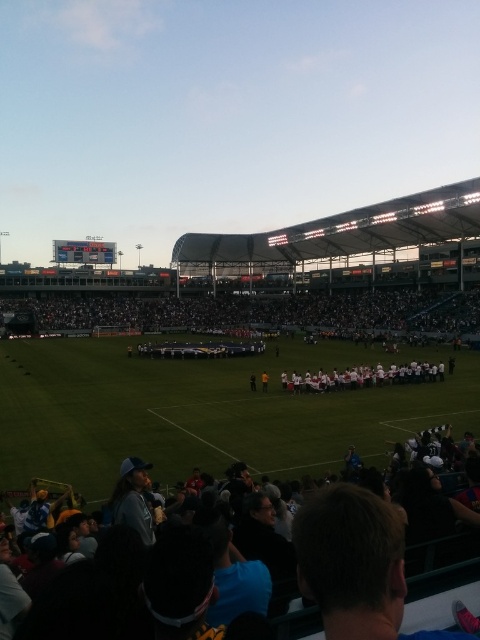
You are a photographer positioned at the edge of the field. You want to capture a photo that includes both the black fabric crowd at center and the dark gray fabric crowd at lower right. Which crowd should you pan your camera towards first to ensure both are in frame?

The black fabric crowd at center is to the left of the dark gray fabric crowd at lower right. To include both in the photo, you should pan your camera towards the black fabric crowd at center first, then adjust to include the dark gray fabric crowd at lower right since it is positioned to the right of the black fabric crowd at center.

You are a photographer at the soccer stadium. You need to capture a photo that highlights both the black fabric crowd at center and the white fabric at center. Which object should you focus on to ensure both are visible in the frame?

The black fabric crowd at center has a larger size compared to white fabric at center, so focusing on the larger black fabric crowd at center will ensure both are visible in the frame.